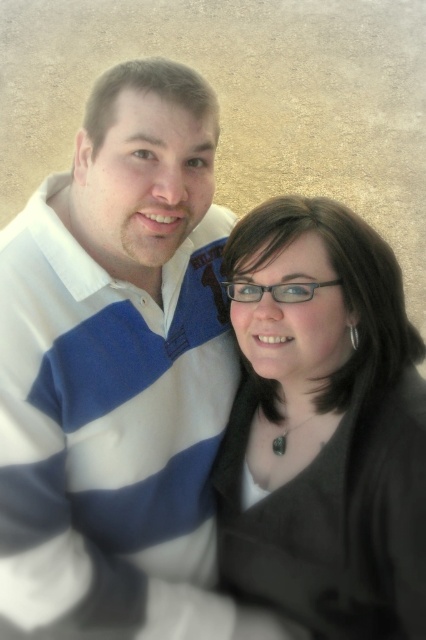
Does white striped sweater at left appear on the left side of black matte glasses at center?

Correct, you'll find white striped sweater at left to the left of black matte glasses at center.

In the scene shown: Does white striped sweater at left have a greater height compared to black matte glasses at center?

Yes, white striped sweater at left is taller than black matte glasses at center.

At what (x,y) coordinates should I click in order to perform the action: click on white striped sweater at left. Please return your answer as a coordinate pair (x, y). The width and height of the screenshot is (426, 640). Looking at the image, I should click on (109, 433).